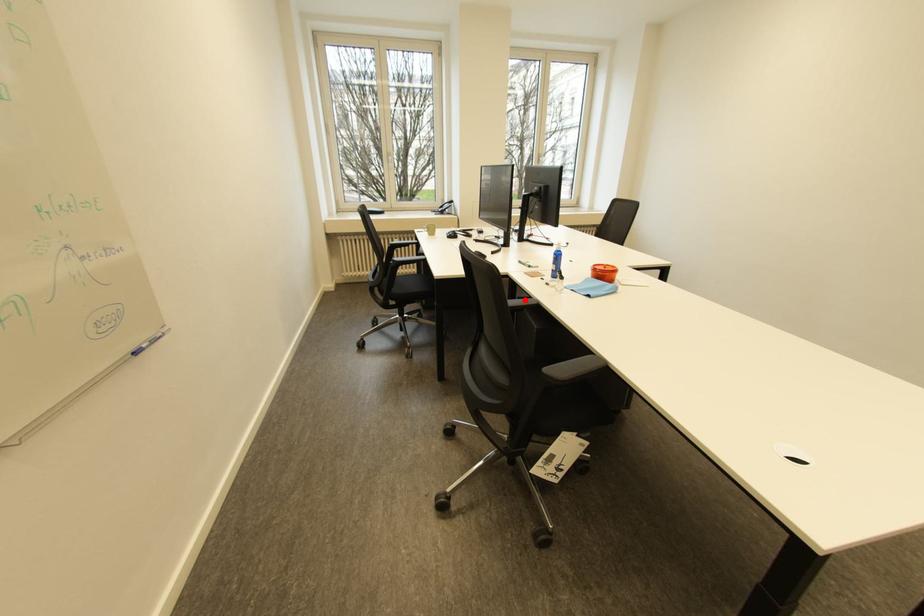
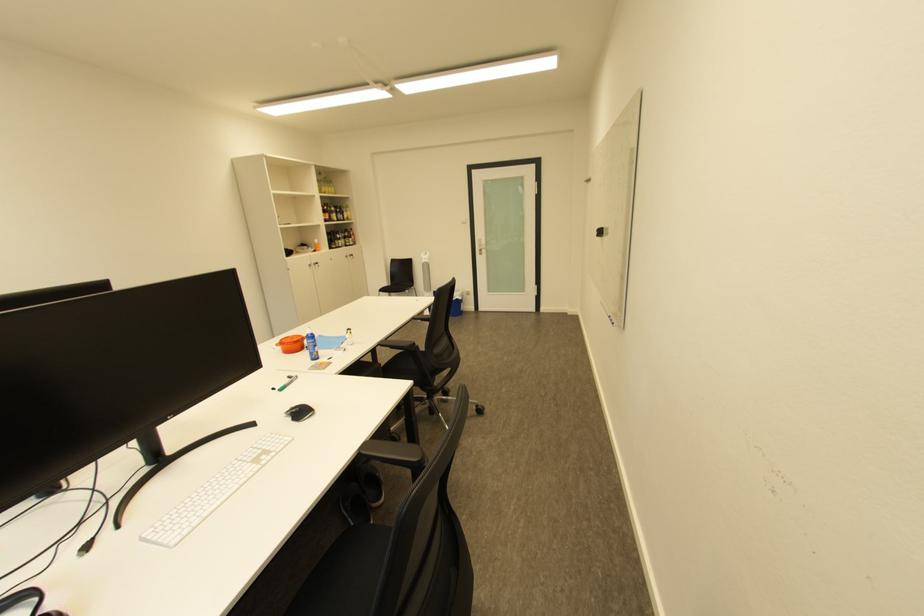
Question: I am providing you with two images of the same scene from different viewpoints. A red point is marked on the first image. At the location where the point appears in image 1, is it still visible in image 2?

Choices:
 (A) Yes
 (B) No

Answer: (B)